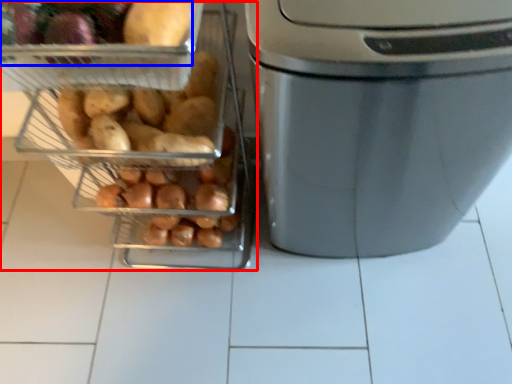
Question: Which object is closer to the camera taking this photo, appliance (highlighted by a red box) or food (highlighted by a blue box)?

Choices:
 (A) appliance
 (B) food

Answer: (A)